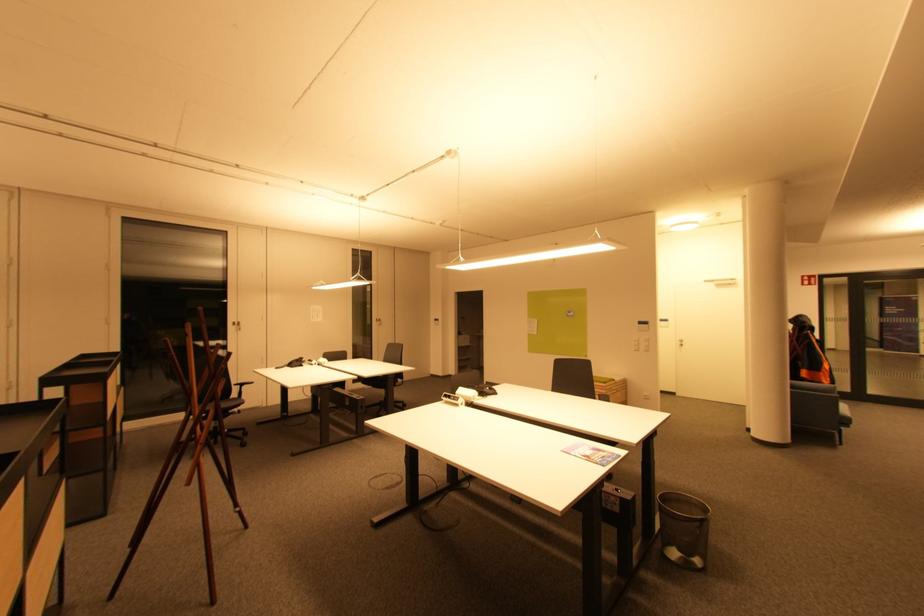
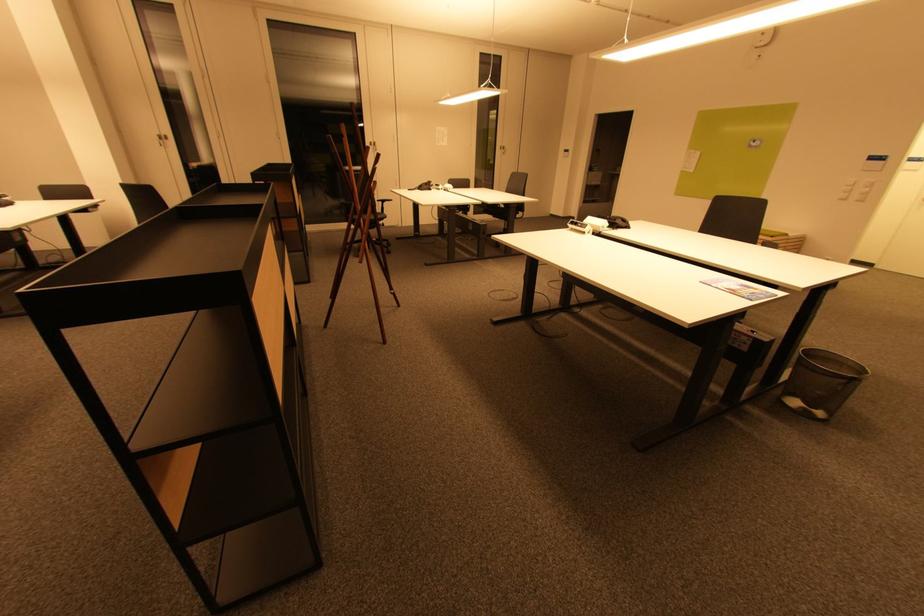
Where in the second image is the point corresponding to (x=446, y=402) from the first image?

(572, 229)